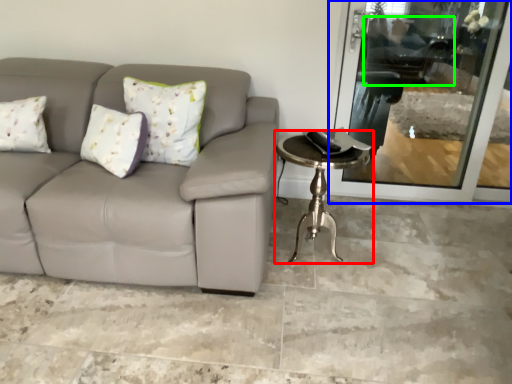
Question: Which object is the farthest from table (highlighted by a red box)? Choose among these: screen door (highlighted by a blue box) or swivel chair (highlighted by a green box).

Choices:
 (A) screen door
 (B) swivel chair

Answer: (B)